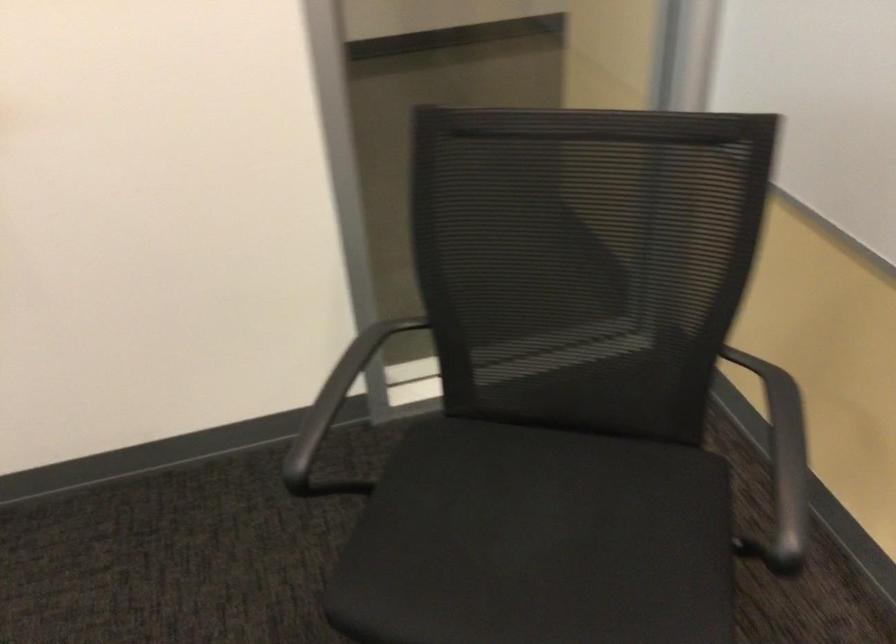
The width and height of the screenshot is (896, 644). Identify the location of chair sitting surface. (538, 542).